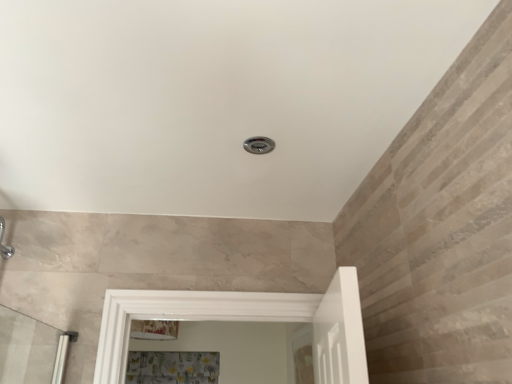
Measure the distance between point (252,142) and camera.

Point (252,142) and camera are 3.74 feet apart from each other.

The height and width of the screenshot is (384, 512). In order to click on brushed metal shower at center in this screenshot , I will do `click(259, 145)`.

Find the location of a particular element. This screenshot has width=512, height=384. clear glass screen door at center is located at coordinates (301, 356).

The height and width of the screenshot is (384, 512). What do you see at coordinates (172, 367) in the screenshot? I see `floral fabric shower curtain at lower center` at bounding box center [172, 367].

Where is `brushed metal shower at center`? brushed metal shower at center is located at coordinates point(259,145).

From the image's perspective, which is below, clear glass screen door at center or brushed metal shower at center?

From the image's view, clear glass screen door at center is below.

Is clear glass screen door at center located outside brushed metal shower at center?

That's correct, clear glass screen door at center is outside of brushed metal shower at center.

Where is `shower in front of the clear glass screen door at center`? This screenshot has height=384, width=512. shower in front of the clear glass screen door at center is located at coordinates (259, 145).

Is point (308, 348) behind point (268, 144)?

Yes, point (308, 348) is behind point (268, 144).

Can you confirm if brushed metal shower at center is shorter than clear glass screen door at center?

Indeed, brushed metal shower at center has a lesser height compared to clear glass screen door at center.

Between brushed metal shower at center and clear glass screen door at center, which one has larger size?

With larger size is clear glass screen door at center.

Measure the distance between brushed metal shower at center and clear glass screen door at center.

They are 4.18 feet apart.

Which is more to the right, brushed metal shower at center or clear glass screen door at center?

From the viewer's perspective, clear glass screen door at center appears more on the right side.

Looking at this image, can you tell me how much clear glass screen door at center and floral fabric shower curtain at lower center differ in facing direction?

The angle between the facing direction of clear glass screen door at center and the facing direction of floral fabric shower curtain at lower center is 89.3 degrees.

Does clear glass screen door at center appear on the left side of floral fabric shower curtain at lower center?

No.

Is clear glass screen door at center oriented away from floral fabric shower curtain at lower center?

clear glass screen door at center is not turned away from floral fabric shower curtain at lower center.

Is clear glass screen door at center spatially inside floral fabric shower curtain at lower center, or outside of it?

clear glass screen door at center is spatially situated outside floral fabric shower curtain at lower center.

Looking at this image, which object is thinner, floral fabric shower curtain at lower center or clear glass screen door at center?

clear glass screen door at center.

From the image's perspective, is floral fabric shower curtain at lower center on clear glass screen door at center?

No.

Is floral fabric shower curtain at lower center positioned beyond the bounds of clear glass screen door at center?

Yes, floral fabric shower curtain at lower center is outside of clear glass screen door at center.

From a real-world perspective, which is physically below, floral fabric shower curtain at lower center or clear glass screen door at center?

floral fabric shower curtain at lower center.

Is floral fabric shower curtain at lower center wider or thinner than brushed metal shower at center?

Clearly, floral fabric shower curtain at lower center has less width compared to brushed metal shower at center.

Can we say floral fabric shower curtain at lower center lies outside brushed metal shower at center?

That's correct, floral fabric shower curtain at lower center is outside of brushed metal shower at center.

From a real-world perspective, is floral fabric shower curtain at lower center located beneath brushed metal shower at center?

Yes, from a real-world perspective, floral fabric shower curtain at lower center is below brushed metal shower at center.

In order to click on shower curtain located underneath the brushed metal shower at center (from a real-world perspective) in this screenshot , I will do `click(172, 367)`.

From the picture: Is brushed metal shower at center facing towards floral fabric shower curtain at lower center?

No, brushed metal shower at center does not turn towards floral fabric shower curtain at lower center.

Is brushed metal shower at center positioned far away from floral fabric shower curtain at lower center?

Absolutely, brushed metal shower at center is distant from floral fabric shower curtain at lower center.

Where is `screen door below the brushed metal shower at center (from a real-world perspective)`? The image size is (512, 384). screen door below the brushed metal shower at center (from a real-world perspective) is located at coordinates (301, 356).

Where is `shower located above the clear glass screen door at center (from the image's perspective)`? shower located above the clear glass screen door at center (from the image's perspective) is located at coordinates (259, 145).

Looking at the image, which one is located closer to floral fabric shower curtain at lower center, clear glass screen door at center or brushed metal shower at center?

The object closer to floral fabric shower curtain at lower center is clear glass screen door at center.

When comparing their distances from floral fabric shower curtain at lower center, does brushed metal shower at center or clear glass screen door at center seem closer?

clear glass screen door at center lies closer to floral fabric shower curtain at lower center than the other object.

Estimate the real-world distances between objects in this image. Which object is closer to brushed metal shower at center, clear glass screen door at center or floral fabric shower curtain at lower center?

clear glass screen door at center.

Based on the photo, looking at the image, which one is located closer to clear glass screen door at center, floral fabric shower curtain at lower center or brushed metal shower at center?

floral fabric shower curtain at lower center.

Consider the image. Looking at the image, which one is located further to clear glass screen door at center, brushed metal shower at center or floral fabric shower curtain at lower center?

brushed metal shower at center lies further to clear glass screen door at center than the other object.

Looking at the image, which one is located closer to brushed metal shower at center, floral fabric shower curtain at lower center or clear glass screen door at center?

Based on the image, clear glass screen door at center appears to be nearer to brushed metal shower at center.

The width and height of the screenshot is (512, 384). Identify the location of screen door between brushed metal shower at center and floral fabric shower curtain at lower center from front to back. (301, 356).